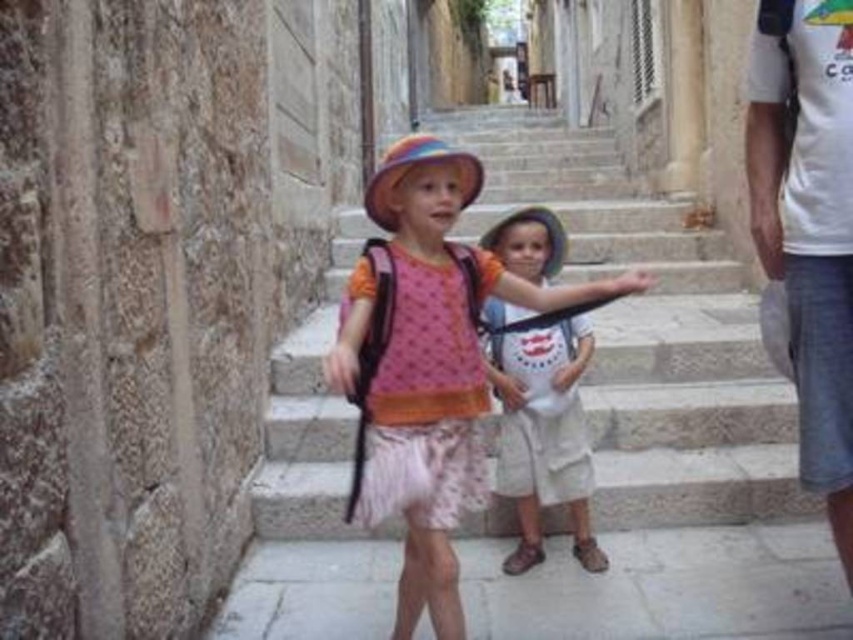
Between point (477, 128) and point (851, 556), which one is positioned behind?

The point (477, 128) is more distant.

Describe the element at coordinates (648, 332) in the screenshot. This screenshot has width=853, height=640. I see `stone stairs at center` at that location.

Locate an element on the screen. stone stairs at center is located at coordinates (648, 332).

Can you confirm if stone stairs at center is positioned to the right of white cotton shirt at center?

Correct, you'll find stone stairs at center to the right of white cotton shirt at center.

Does stone stairs at center appear under white cotton shirt at center?

No.

The height and width of the screenshot is (640, 853). In order to click on stone stairs at center in this screenshot , I will do `click(648, 332)`.

Is rough stone wall at left thinner than stone stairs at center?

Yes.

Is point (273, 243) behind point (506, 179)?

No, it is in front of (506, 179).

At what (x,y) coordinates should I click in order to perform the action: click on rough stone wall at left. Please return your answer as a coordinate pair (x, y). Looking at the image, I should click on (128, 308).